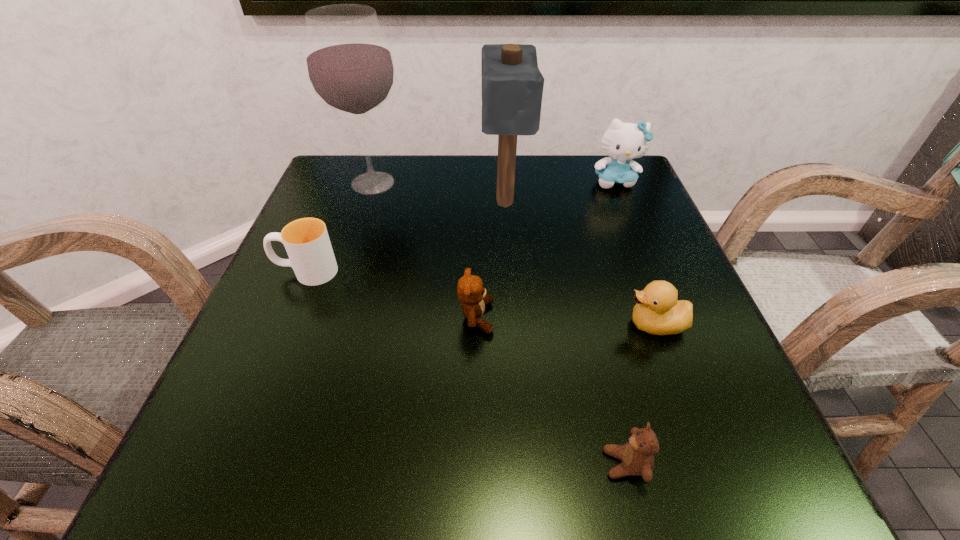
The height and width of the screenshot is (540, 960). What are the coordinates of `alcohol` in the screenshot? It's located at (350, 67).

Where is `mallet`? The image size is (960, 540). mallet is located at coordinates (512, 85).

Identify the location of the third tallest object. (623, 142).

The image size is (960, 540). In order to click on the fourth farthest object in this screenshot , I will do (306, 240).

Where is `the left teddy bear`? the left teddy bear is located at coordinates (470, 291).

Find the location of a particular element. The image size is (960, 540). duckling is located at coordinates (657, 311).

Locate an element on the screen. the third object from right to left is located at coordinates (637, 455).

I want to click on the right teddy bear, so click(637, 455).

The width and height of the screenshot is (960, 540). Identify the location of vacant space located on the back of the alcohol. (382, 155).

The height and width of the screenshot is (540, 960). In order to click on vacant space located on the front of the mallet in this screenshot , I will do `click(510, 275)`.